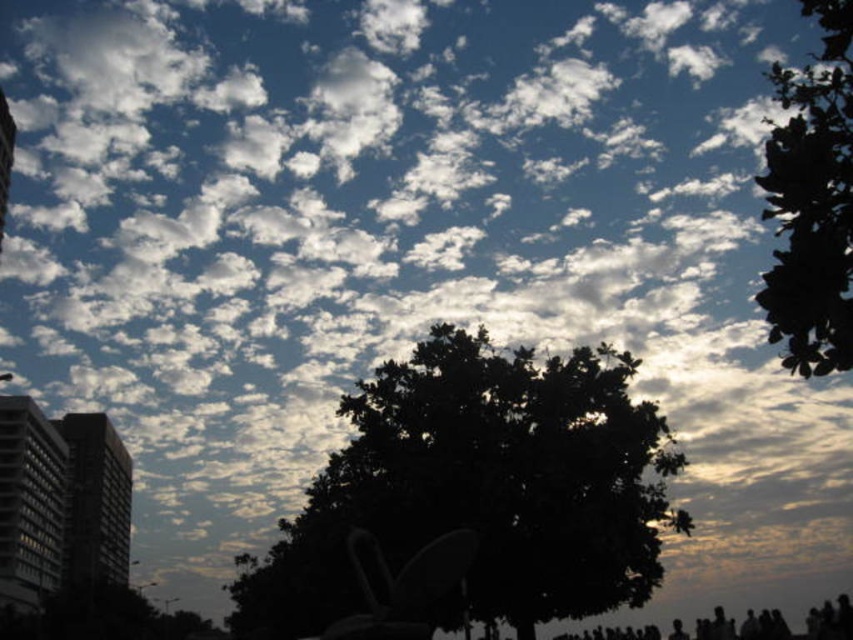
Question: Is dark green leafy tree at center to the left of green leafy tree at upper right from the viewer's perspective?

Choices:
 (A) yes
 (B) no

Answer: (A)

Question: Does gray concrete building at left appear on the left side of dark gray concrete building at left?

Choices:
 (A) yes
 (B) no

Answer: (B)

Question: Among these objects, which one is farthest from the camera?

Choices:
 (A) gray concrete building at left
 (B) dark gray concrete building at left
 (C) dark green leafy tree at center

Answer: (B)

Question: Which object appears farthest from the camera in this image?

Choices:
 (A) dark green leafy tree at center
 (B) green leafy tree at upper right

Answer: (A)

Question: Is dark green leafy tree at center thinner than gray concrete building at left?

Choices:
 (A) yes
 (B) no

Answer: (B)

Question: Which of the following is the farthest from the observer?

Choices:
 (A) green leafy tree at upper right
 (B) dark gray concrete building at left
 (C) dark green leafy tree at center
 (D) gray concrete building at left

Answer: (B)